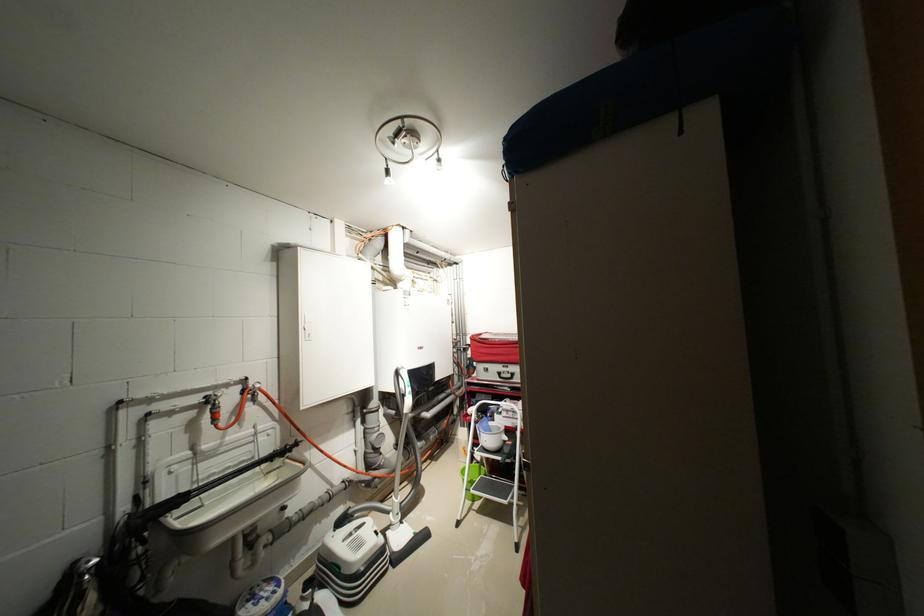
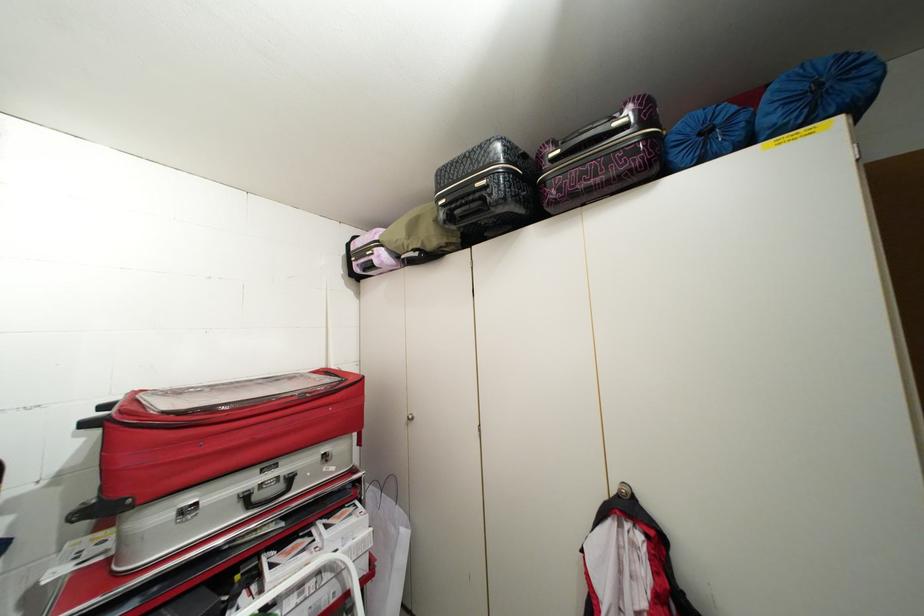
Locate, in the second image, the point that corresponds to point 517,377 in the first image.

(287, 487)